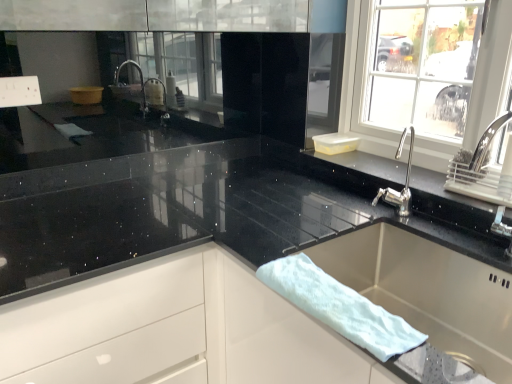
Question: Is white glossy drawer at center looking in the opposite direction of stainless steel sink at lower right?

Choices:
 (A) yes
 (B) no

Answer: (B)

Question: Is white glossy drawer at center to the right of stainless steel sink at lower right from the viewer's perspective?

Choices:
 (A) no
 (B) yes

Answer: (A)

Question: Is stainless steel sink at lower right a part of white glossy drawer at center?

Choices:
 (A) yes
 (B) no

Answer: (B)

Question: Considering the relative sizes of white glossy drawer at center and stainless steel sink at lower right in the image provided, is white glossy drawer at center bigger than stainless steel sink at lower right?

Choices:
 (A) no
 (B) yes

Answer: (B)

Question: Does white glossy drawer at center have a lesser width compared to stainless steel sink at lower right?

Choices:
 (A) no
 (B) yes

Answer: (A)

Question: Is white glossy drawer at center closer to camera compared to stainless steel sink at lower right?

Choices:
 (A) no
 (B) yes

Answer: (A)

Question: Considering the relative sizes of white fluffy bath towel at sink and white glossy drawer at center in the image provided, is white fluffy bath towel at sink bigger than white glossy drawer at center?

Choices:
 (A) no
 (B) yes

Answer: (A)

Question: Is white fluffy bath towel at sink shorter than white glossy drawer at center?

Choices:
 (A) no
 (B) yes

Answer: (B)

Question: Is white fluffy bath towel at sink positioned with its back to white glossy drawer at center?

Choices:
 (A) yes
 (B) no

Answer: (B)

Question: Can you confirm if white fluffy bath towel at sink is smaller than white glossy drawer at center?

Choices:
 (A) no
 (B) yes

Answer: (B)

Question: From the image's perspective, is white fluffy bath towel at sink on top of white glossy drawer at center?

Choices:
 (A) no
 (B) yes

Answer: (B)

Question: Does white fluffy bath towel at sink have a lesser width compared to white glossy drawer at center?

Choices:
 (A) yes
 (B) no

Answer: (A)

Question: Is stainless steel sink at lower right taller than white glossy drawer at center?

Choices:
 (A) no
 (B) yes

Answer: (A)